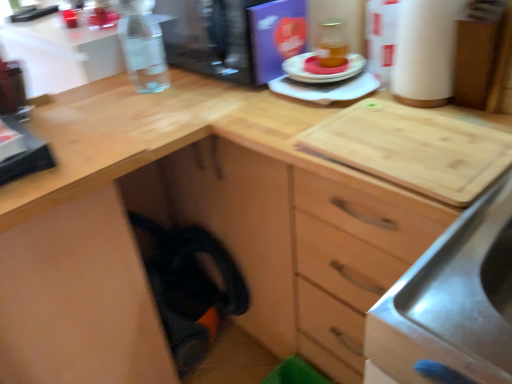
This screenshot has width=512, height=384. Identify the location of white cardboard paper towel at upper right. (425, 52).

Identify the location of clear glass bottle at upper left. (143, 46).

At what (x,y) coordinates should I click in order to perform the action: click on transparent plastic water bottle at upper left, placed as the 2th appliance when sorted from bottom to top. Please return your answer as a coordinate pair (x, y). Looking at the image, I should click on (225, 35).

How much space does transparent plastic water bottle at upper left, the first appliance viewed from the top, occupy horizontally?

15.20 inches.

Find the location of a particular element. matte plastic plate at center, placed as the first appliance when sorted from bottom to top is located at coordinates (324, 81).

In the scene shown: Can we say white cardboard paper towel at upper right lies outside matte plastic plate at center, placed as the second appliance when sorted from top to bottom?

Indeed, white cardboard paper towel at upper right is completely outside matte plastic plate at center, placed as the second appliance when sorted from top to bottom.

Is point (408, 71) positioned after point (357, 86)?

No, (408, 71) is in front of (357, 86).

Would you say white cardboard paper towel at upper right is a long distance from matte plastic plate at center, placed as the first appliance when sorted from bottom to top?

Actually, white cardboard paper towel at upper right and matte plastic plate at center, placed as the first appliance when sorted from bottom to top, are a little close together.

Is clear glass bottle at upper left oriented towards transparent plastic water bottle at upper left, placed as the 2th appliance when sorted from bottom to top?

No, clear glass bottle at upper left is not turned towards transparent plastic water bottle at upper left, placed as the 2th appliance when sorted from bottom to top.

Which object is more forward, clear glass bottle at upper left or transparent plastic water bottle at upper left, the first appliance viewed from the top?

clear glass bottle at upper left is in front.

From the image's perspective, is clear glass bottle at upper left positioned above or below transparent plastic water bottle at upper left, placed as the 2th appliance when sorted from bottom to top?

From the image's perspective, clear glass bottle at upper left appears below transparent plastic water bottle at upper left, placed as the 2th appliance when sorted from bottom to top.

From the picture: From a real-world perspective, is clear glass bottle at upper left physically below transparent plastic water bottle at upper left, the first appliance viewed from the top?

No.

Is white cardboard paper towel at upper right next to clear glass bottle at upper left and touching it?

No, white cardboard paper towel at upper right is not in contact with clear glass bottle at upper left.

From the image's perspective, does white cardboard paper towel at upper right appear lower than clear glass bottle at upper left?

Correct, white cardboard paper towel at upper right appears lower than clear glass bottle at upper left in the image.

Can clear glass bottle at upper left be found inside white cardboard paper towel at upper right?

No.

Could you tell me if white cardboard paper towel at upper right is turned towards clear glass bottle at upper left?

No, white cardboard paper towel at upper right is not turned towards clear glass bottle at upper left.

From a real-world perspective, which is physically below, matte plastic plate at center, placed as the second appliance when sorted from top to bottom, or transparent plastic water bottle at upper left, placed as the 2th appliance when sorted from bottom to top?

matte plastic plate at center, placed as the second appliance when sorted from top to bottom, is physically lower.

The height and width of the screenshot is (384, 512). I want to click on appliance lying on the left of matte plastic plate at center, placed as the second appliance when sorted from top to bottom, so click(x=225, y=35).

From the image's perspective, is matte plastic plate at center, placed as the second appliance when sorted from top to bottom, below transparent plastic water bottle at upper left, the first appliance viewed from the top?

Correct, matte plastic plate at center, placed as the second appliance when sorted from top to bottom, appears lower than transparent plastic water bottle at upper left, the first appliance viewed from the top, in the image.

Could you measure the distance between matte plastic plate at center, placed as the first appliance when sorted from bottom to top, and transparent plastic water bottle at upper left, placed as the 2th appliance when sorted from bottom to top?

matte plastic plate at center, placed as the first appliance when sorted from bottom to top, and transparent plastic water bottle at upper left, placed as the 2th appliance when sorted from bottom to top, are 7.10 inches apart from each other.

In terms of width, does clear glass bottle at upper left look wider or thinner when compared to matte orange cake at center?

Considering their sizes, clear glass bottle at upper left looks broader than matte orange cake at center.

Consider the image. Is matte orange cake at center surrounded by clear glass bottle at upper left?

Definitely not — matte orange cake at center is not inside clear glass bottle at upper left.

From a real-world perspective, who is located lower, clear glass bottle at upper left or matte orange cake at center?

In real-world perspective, matte orange cake at center is lower.

Considering the relative sizes of matte orange cake at center and clear glass bottle at upper left in the image provided, is matte orange cake at center taller than clear glass bottle at upper left?

No, matte orange cake at center is not taller than clear glass bottle at upper left.

Is clear glass bottle at upper left inside matte orange cake at center?

No, clear glass bottle at upper left is not surrounded by matte orange cake at center.

In the scene shown: Is matte orange cake at center positioned with its back to clear glass bottle at upper left?

No, matte orange cake at center's orientation is not away from clear glass bottle at upper left.

Which is in front, point (325, 74) or point (137, 44)?

The point (325, 74) is more forward.

Between matte plastic plate at center, placed as the first appliance when sorted from bottom to top, and matte orange cake at center, which one has smaller size?

matte orange cake at center is smaller.

From a real-world perspective, between matte plastic plate at center, placed as the first appliance when sorted from bottom to top, and matte orange cake at center, who is vertically lower?

matte plastic plate at center, placed as the first appliance when sorted from bottom to top, from a real-world perspective.

Does point (309, 53) appear closer or farther from the camera than point (338, 67)?

Point (309, 53) appears to be farther away from the viewer than point (338, 67).

Which object is closer to the camera, matte plastic plate at center, placed as the second appliance when sorted from top to bottom, or matte orange cake at center?

matte plastic plate at center, placed as the second appliance when sorted from top to bottom, is in front.

Identify the location of paper towel above the matte plastic plate at center, placed as the first appliance when sorted from bottom to top (from a real-world perspective). (425, 52).

The height and width of the screenshot is (384, 512). I want to click on bottle that is in front of the transparent plastic water bottle at upper left, placed as the 2th appliance when sorted from bottom to top, so click(x=143, y=46).

From the image, which object appears to be farther from white cardboard paper towel at upper right, matte orange cake at center or matte plastic plate at center, placed as the second appliance when sorted from top to bottom?

matte orange cake at center lies further to white cardboard paper towel at upper right than the other object.

From the picture: Looking at the image, which one is located closer to white cardboard paper towel at upper right, matte orange cake at center or clear glass bottle at upper left?

Among the two, matte orange cake at center is located nearer to white cardboard paper towel at upper right.

From the image, which object appears to be farther from matte plastic plate at center, placed as the first appliance when sorted from bottom to top, matte orange cake at center or transparent plastic water bottle at upper left, placed as the 2th appliance when sorted from bottom to top?

The object further to matte plastic plate at center, placed as the first appliance when sorted from bottom to top, is transparent plastic water bottle at upper left, placed as the 2th appliance when sorted from bottom to top.

Which object lies nearer to the anchor point matte plastic plate at center, placed as the first appliance when sorted from bottom to top, clear glass bottle at upper left or white cardboard paper towel at upper right?

white cardboard paper towel at upper right lies closer to matte plastic plate at center, placed as the first appliance when sorted from bottom to top, than the other object.

Which object lies further to the anchor point matte plastic plate at center, placed as the second appliance when sorted from top to bottom, transparent plastic water bottle at upper left, the first appliance viewed from the top, or matte orange cake at center?

transparent plastic water bottle at upper left, the first appliance viewed from the top, is positioned further to the anchor matte plastic plate at center, placed as the second appliance when sorted from top to bottom.

Considering their positions, is matte plastic plate at center, placed as the first appliance when sorted from bottom to top, positioned closer to matte orange cake at center than transparent plastic water bottle at upper left, the first appliance viewed from the top?

Based on the image, matte plastic plate at center, placed as the first appliance when sorted from bottom to top, appears to be nearer to matte orange cake at center.

Looking at the image, which one is located closer to matte plastic plate at center, placed as the first appliance when sorted from bottom to top, white cardboard paper towel at upper right or matte orange cake at center?

matte orange cake at center is positioned closer to the anchor matte plastic plate at center, placed as the first appliance when sorted from bottom to top.

Estimate the real-world distances between objects in this image. Which object is closer to transparent plastic water bottle at upper left, the first appliance viewed from the top, white cardboard paper towel at upper right or matte orange cake at center?

Among the two, matte orange cake at center is located nearer to transparent plastic water bottle at upper left, the first appliance viewed from the top.

Where is `appliance situated between transparent plastic water bottle at upper left, placed as the 2th appliance when sorted from bottom to top, and white cardboard paper towel at upper right from left to right`? The width and height of the screenshot is (512, 384). appliance situated between transparent plastic water bottle at upper left, placed as the 2th appliance when sorted from bottom to top, and white cardboard paper towel at upper right from left to right is located at coordinates tap(324, 81).

This screenshot has height=384, width=512. I want to click on food between clear glass bottle at upper left and matte plastic plate at center, placed as the first appliance when sorted from bottom to top, from left to right, so click(x=323, y=67).

The height and width of the screenshot is (384, 512). What are the coordinates of `appliance between clear glass bottle at upper left and matte plastic plate at center, placed as the first appliance when sorted from bottom to top, in the horizontal direction` in the screenshot? It's located at (225, 35).

What are the coordinates of `appliance between clear glass bottle at upper left and matte orange cake at center in the horizontal direction` in the screenshot? It's located at (225, 35).